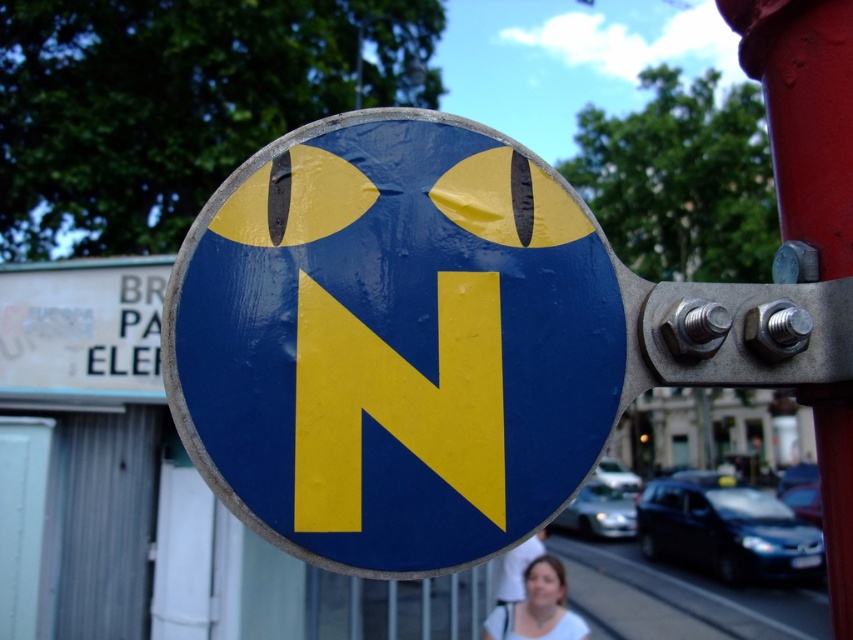
Who is positioned more to the left, yellow matte sign at center or smooth white blouse at lower center?

yellow matte sign at center is more to the left.

Is point (390, 433) farther from viewer compared to point (543, 584)?

No, (390, 433) is closer to viewer.

Locate an element on the screen. This screenshot has height=640, width=853. yellow matte sign at center is located at coordinates (397, 401).

Does point (788, 56) come behind point (492, 618)?

No, it is not.

The height and width of the screenshot is (640, 853). I want to click on metallic red pole at right, so click(805, 115).

Locate an element on the screen. The width and height of the screenshot is (853, 640). metallic red pole at right is located at coordinates (805, 115).

Is matte blue sign at center wider than metallic red pole at right?

Yes, matte blue sign at center is wider than metallic red pole at right.

Where is `matte blue sign at center`? matte blue sign at center is located at coordinates (395, 342).

Locate an element on the screen. The width and height of the screenshot is (853, 640). matte blue sign at center is located at coordinates (395, 342).